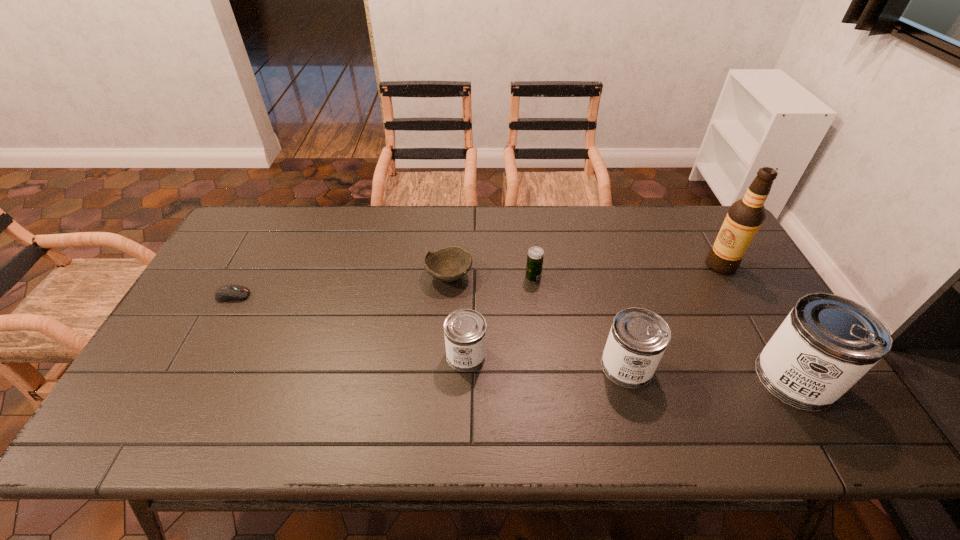
At what (x,y) coordinates should I click in order to perform the action: click on the leftmost can. Please return your answer as a coordinate pair (x, y). This screenshot has width=960, height=540. Looking at the image, I should click on (465, 330).

This screenshot has height=540, width=960. In order to click on the third tallest object in this screenshot , I will do `click(638, 338)`.

Image resolution: width=960 pixels, height=540 pixels. In order to click on the fifth object from left to right in this screenshot , I will do `click(638, 338)`.

Locate an element on the screen. the rightmost can is located at coordinates (827, 343).

Where is `the second tallest object`? This screenshot has height=540, width=960. the second tallest object is located at coordinates (827, 343).

Where is `the fourth object from right to left`? The image size is (960, 540). the fourth object from right to left is located at coordinates (535, 256).

Identify the location of the tallest object. (745, 216).

This screenshot has height=540, width=960. I want to click on computer equipment, so click(231, 292).

The image size is (960, 540). What are the coordinates of `the shortest object` in the screenshot? It's located at (231, 292).

You are a GUI agent. You are given a task and a screenshot of the screen. Output one action in this format:
    pyautogui.click(x=<x>, y=<y>)
    Task: Click on the bowl
    The height and width of the screenshot is (540, 960).
    Given the screenshot: What is the action you would take?
    pyautogui.click(x=449, y=264)